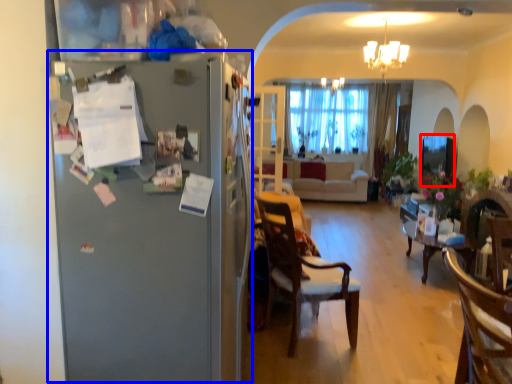
Question: Which of the following is the farthest to the observer, window screen (highlighted by a red box) or fridge (highlighted by a blue box)?

Choices:
 (A) window screen
 (B) fridge

Answer: (A)